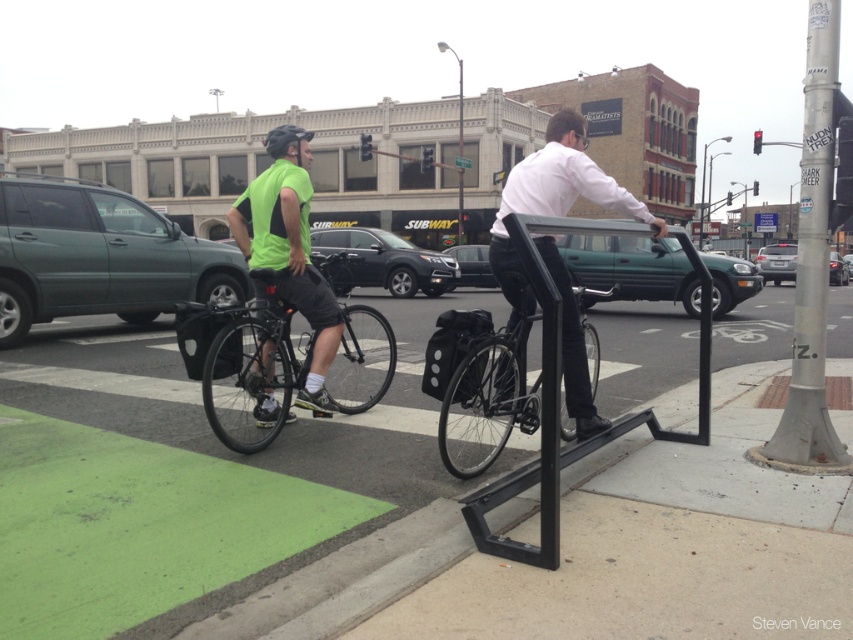
Which is more to the right, silver metallic pole at right or matte black suv at center?

From the viewer's perspective, silver metallic pole at right appears more on the right side.

Find the location of a particular element. silver metallic pole at right is located at coordinates (811, 260).

Is shiny black bicycle at center to the right of matte white shirt at center from the viewer's perspective?

In fact, shiny black bicycle at center is to the left of matte white shirt at center.

In the scene shown: Can you confirm if shiny black bicycle at center is positioned below matte white shirt at center?

Yes.

Is point (206, 371) farther from viewer compared to point (555, 138)?

No, it is not.

Identify the location of shiny black bicycle at center. (242, 358).

Is green matte suv at left to the right of silver metallic sedan at center from the viewer's perspective?

Incorrect, green matte suv at left is not on the right side of silver metallic sedan at center.

Who is positioned more to the right, green matte suv at left or silver metallic sedan at center?

From the viewer's perspective, silver metallic sedan at center appears more on the right side.

Describe the element at coordinates (99, 257) in the screenshot. The height and width of the screenshot is (640, 853). I see `green matte suv at left` at that location.

Find the location of `green matte suv at left`. green matte suv at left is located at coordinates (99, 257).